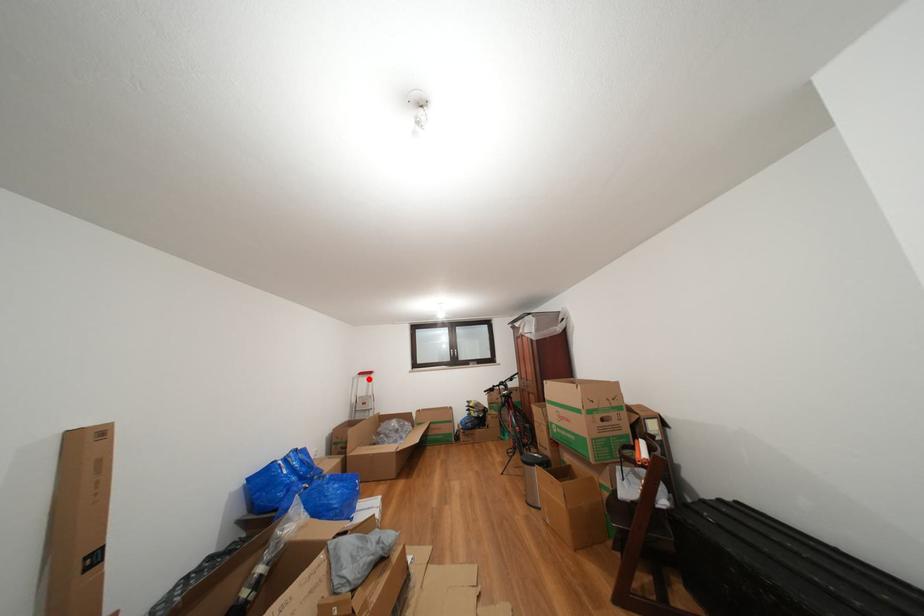
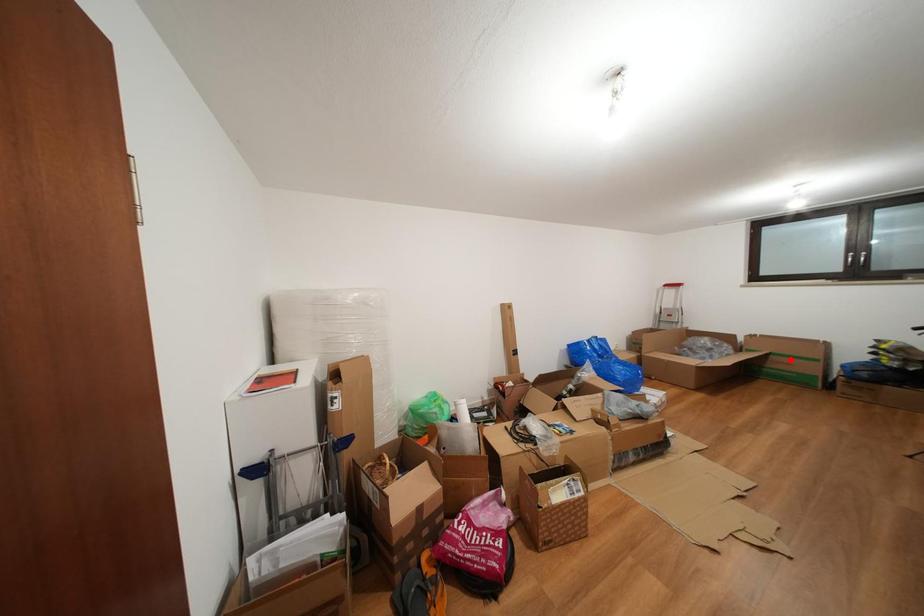
I am providing you with two images of the same scene from different viewpoints. A red point is marked on the first image and another point is marked on the second image. Is the red point in image1 aligned with the point shown in image2?

No